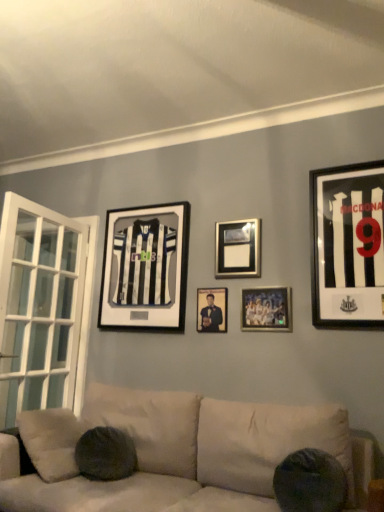
Question: In which direction should I rotate to look at black and white jersey at upper center, placed as the 1th picture frame when sorted from left to right?

Choices:
 (A) right
 (B) left

Answer: (B)

Question: Can you confirm if black matte jersey at right, the 5th picture frame in the left-to-right sequence, is thinner than metallic silver picture frame at center, which ranks as the third picture frame in left-to-right order?

Choices:
 (A) no
 (B) yes

Answer: (A)

Question: Is black matte jersey at right, the first picture frame from the right, oriented away from metallic silver picture frame at center, which ranks as the third picture frame in left-to-right order?

Choices:
 (A) no
 (B) yes

Answer: (A)

Question: Is black matte jersey at right, the first picture frame from the right, positioned in front of metallic silver picture frame at center, acting as the 3th picture frame starting from the right?

Choices:
 (A) no
 (B) yes

Answer: (B)

Question: From the image's perspective, is black matte jersey at right, the first picture frame from the right, beneath metallic silver picture frame at center, acting as the 3th picture frame starting from the right?

Choices:
 (A) no
 (B) yes

Answer: (A)

Question: Can you confirm if black matte jersey at right, the first picture frame from the right, is bigger than metallic silver picture frame at center, acting as the 3th picture frame starting from the right?

Choices:
 (A) no
 (B) yes

Answer: (B)

Question: Is black matte jersey at right, the first picture frame from the right, not within metallic silver picture frame at center, acting as the 3th picture frame starting from the right?

Choices:
 (A) yes
 (B) no

Answer: (A)

Question: Is matte black portrait at center, the second picture frame positioned from the left, inside black matte jersey at right, the first picture frame from the right?

Choices:
 (A) no
 (B) yes

Answer: (A)

Question: Does black matte jersey at right, the first picture frame from the right, appear on the right side of matte black portrait at center, marked as the 4th picture frame in a right-to-left arrangement?

Choices:
 (A) yes
 (B) no

Answer: (A)

Question: Is black matte jersey at right, the first picture frame from the right, in contact with matte black portrait at center, the second picture frame positioned from the left?

Choices:
 (A) yes
 (B) no

Answer: (B)

Question: Can you confirm if black matte jersey at right, the first picture frame from the right, is wider than matte black portrait at center, the second picture frame positioned from the left?

Choices:
 (A) yes
 (B) no

Answer: (A)

Question: Could you tell me if black matte jersey at right, the first picture frame from the right, is facing matte black portrait at center, marked as the 4th picture frame in a right-to-left arrangement?

Choices:
 (A) no
 (B) yes

Answer: (A)

Question: Considering the relative sizes of black matte jersey at right, the 5th picture frame in the left-to-right sequence, and matte black portrait at center, marked as the 4th picture frame in a right-to-left arrangement, in the image provided, is black matte jersey at right, the 5th picture frame in the left-to-right sequence, smaller than matte black portrait at center, marked as the 4th picture frame in a right-to-left arrangement,?

Choices:
 (A) no
 (B) yes

Answer: (A)

Question: Can you confirm if black matte jersey at right, the 5th picture frame in the left-to-right sequence, is smaller than black and white jersey at upper center, acting as the 5th picture frame starting from the right?

Choices:
 (A) yes
 (B) no

Answer: (A)